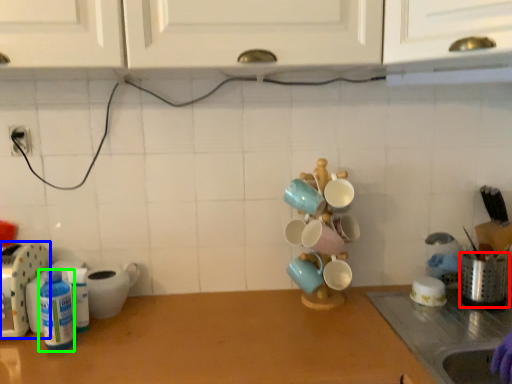
Question: Estimate the real-world distances between objects in this image. Which object is closer to appliance (highlighted by a red box), appliance (highlighted by a blue box) or bottle (highlighted by a green box)?

Choices:
 (A) appliance
 (B) bottle

Answer: (B)